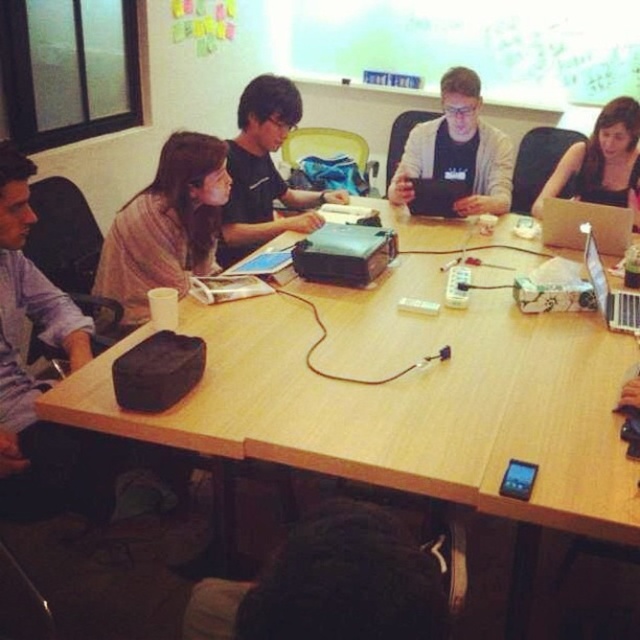
Can you confirm if black matte shirt at center is positioned above satin silver laptop at upper right?

Yes.

Locate an element on the screen. black matte shirt at center is located at coordinates (264, 172).

Does black fabric bag at lower center appear under silver metallic laptop at upper right?

Indeed, black fabric bag at lower center is positioned under silver metallic laptop at upper right.

Which is in front, point (269, 566) or point (616, 292)?

Point (269, 566) is in front.

Find the location of a particular element. black fabric bag at lower center is located at coordinates (330, 586).

Image resolution: width=640 pixels, height=640 pixels. I want to click on black fabric bag at lower center, so click(x=330, y=586).

Where is `wooden table at center`? This screenshot has height=640, width=640. wooden table at center is located at coordinates (403, 392).

Who is more distant from viewer, (480, 355) or (589, 241)?

The point (589, 241) is behind.

Who is more forward, (476, 237) or (598, 257)?

Point (598, 257) is more forward.

Find the location of a particular element. The width and height of the screenshot is (640, 640). wooden table at center is located at coordinates (403, 392).